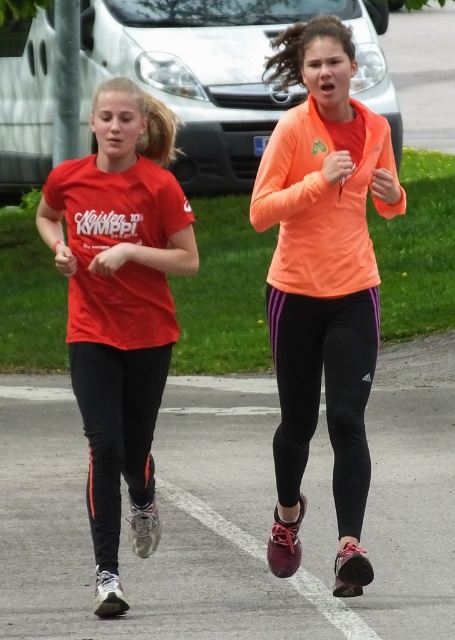
Question: Is orange matte long-sleeve shirt at center thinner than matte red t-shirt at left?

Choices:
 (A) no
 (B) yes

Answer: (B)

Question: Is orange matte long-sleeve shirt at center positioned before matte red t-shirt at left?

Choices:
 (A) no
 (B) yes

Answer: (B)

Question: Which point is farther to the camera?

Choices:
 (A) (99, 568)
 (B) (348, 58)

Answer: (B)

Question: Which point appears closest to the camera in this image?

Choices:
 (A) (375, 132)
 (B) (151, 316)

Answer: (B)

Question: Can you confirm if orange matte long-sleeve shirt at center is positioned to the right of matte red t-shirt at left?

Choices:
 (A) no
 (B) yes

Answer: (B)